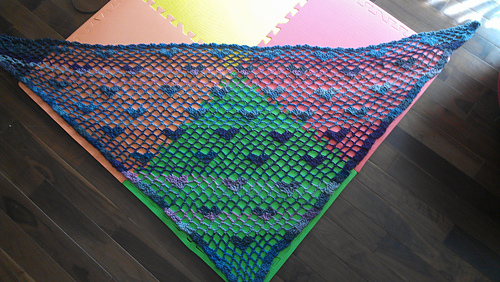
Locate an element on the screen. floor is located at coordinates (369, 253).